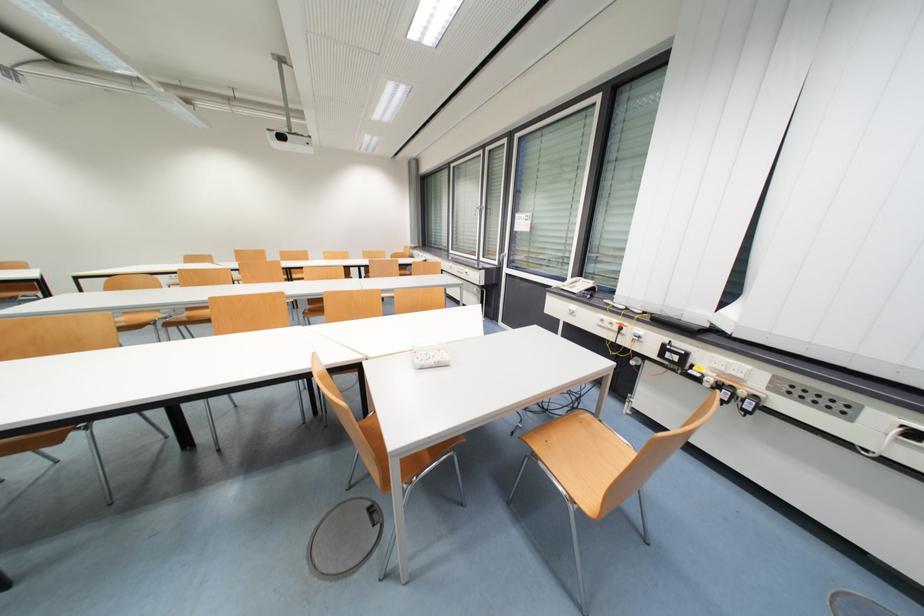
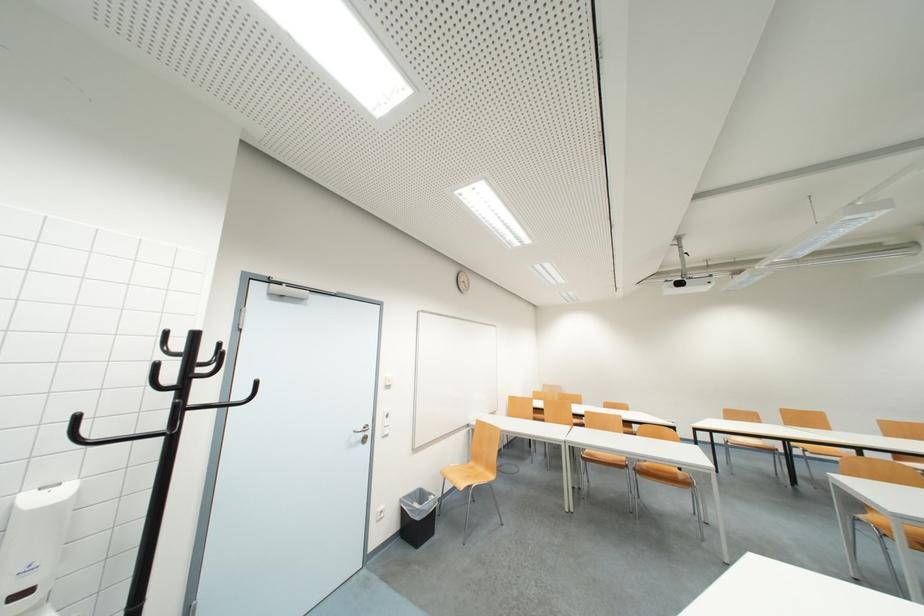
In the second image, find the point that corresponds to (197,261) in the first image.

(736, 416)